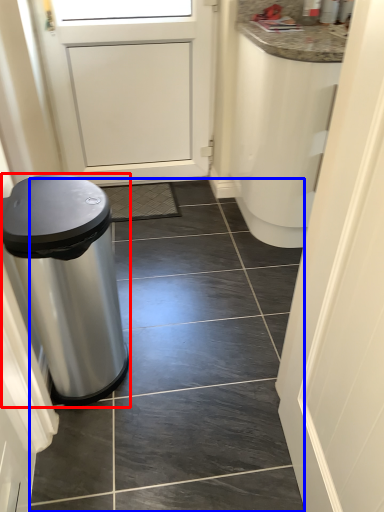
Question: Which of the following is the farthest to the observer, waste container (highlighted by a red box) or tile (highlighted by a blue box)?

Choices:
 (A) waste container
 (B) tile

Answer: (B)